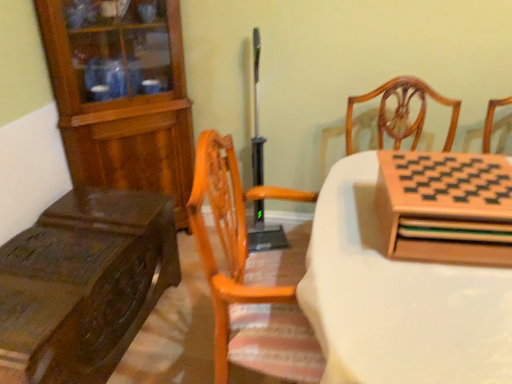
Question: From the image's perspective, is dark brown wood table at left, the first table positioned from the left, located above or below wooden cabinet at left, placed as the 1th cabinetry when sorted from left to right?

Choices:
 (A) above
 (B) below

Answer: (B)

Question: Considering the positions of dark brown wood table at left, the first table positioned from the left, and wooden cabinet at left, placed as the 1th cabinetry when sorted from left to right, in the image, is dark brown wood table at left, the first table positioned from the left, bigger or smaller than wooden cabinet at left, placed as the 1th cabinetry when sorted from left to right,?

Choices:
 (A) small
 (B) big

Answer: (A)

Question: Which is farther from the wooden chessboard at right, the second cabinetry when ordered from left to right?

Choices:
 (A) dark brown wood table at left, the first table positioned from the left
 (B) wooden chessboard at upper right, which appears as the 1th table when viewed from the right
 (C) wooden cabinet at left, which appears as the first cabinetry when viewed from the back

Answer: (C)

Question: Estimate the real-world distances between objects in this image. Which object is farther from the dark brown wood table at left, the first table positioned from the left?

Choices:
 (A) wooden chessboard at upper right, which appears as the second table when viewed from the left
 (B) wooden cabinet at left, marked as the second cabinetry in a right-to-left arrangement
 (C) wooden chessboard at right, the second cabinetry when ordered from left to right

Answer: (C)